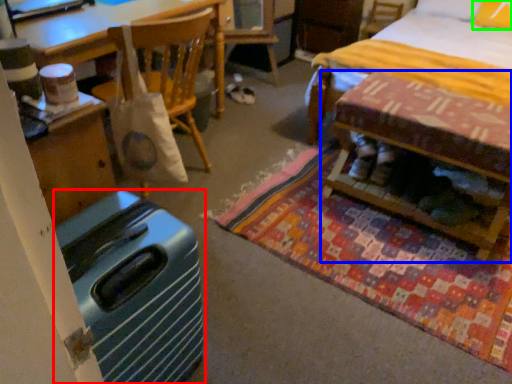
Question: Based on their relative distances, which object is farther from luggage (highlighted by a red box)? Choose from table (highlighted by a blue box) and pillow (highlighted by a green box).

Choices:
 (A) table
 (B) pillow

Answer: (B)